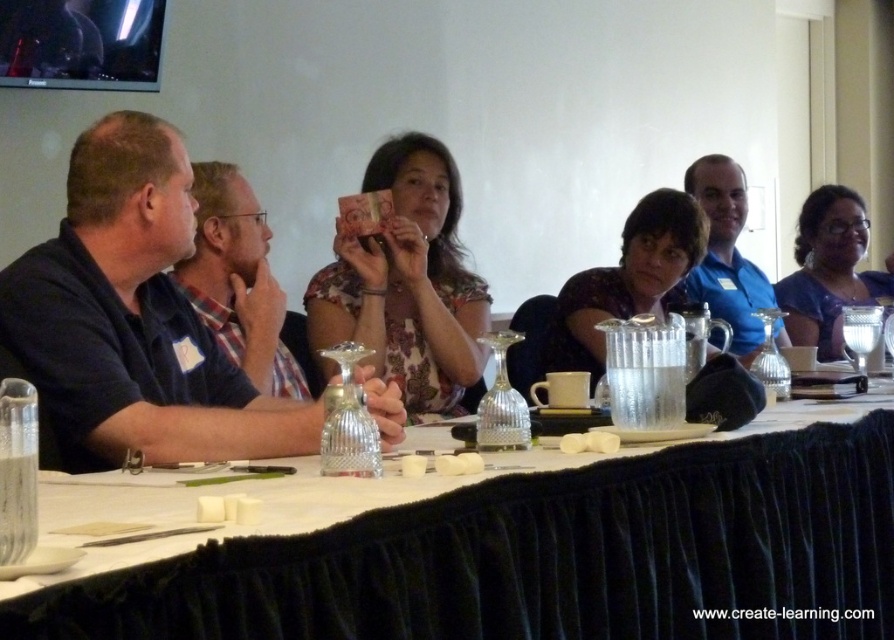
Question: Among these points, which one is farthest from the camera?

Choices:
 (A) (778, 572)
 (B) (679, 289)

Answer: (B)

Question: Where is white cloth table at center located in relation to blue shirt at center in the image?

Choices:
 (A) above
 (B) below

Answer: (B)

Question: Does matte black shirt at left appear on the left side of blue satin dress at right?

Choices:
 (A) yes
 (B) no

Answer: (A)

Question: Can you confirm if floral fabric shirt at center is positioned to the right of blue satin dress at right?

Choices:
 (A) no
 (B) yes

Answer: (A)

Question: Which object is positioned closest to the white cloth table at center?

Choices:
 (A) blue satin dress at right
 (B) translucent glass pitcher at center
 (C) floral fabric shirt at center

Answer: (B)

Question: Which point is closer to the camera taking this photo?

Choices:
 (A) pos(861,292)
 (B) pos(569,332)

Answer: (B)